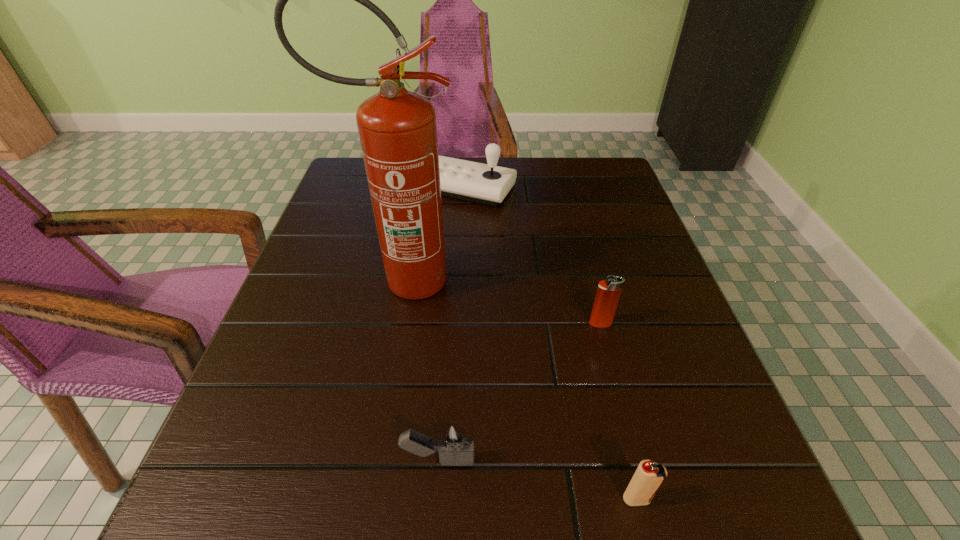
Find the location of a particular element. The height and width of the screenshot is (540, 960). the tallest object is located at coordinates (x=397, y=128).

In order to click on the fourth nearest object in this screenshot , I will do `click(397, 128)`.

The width and height of the screenshot is (960, 540). Identify the location of the farthest object. (488, 184).

At what (x,y) coordinates should I click in order to perform the action: click on the farthest igniter. Please return your answer as a coordinate pair (x, y). Looking at the image, I should click on (608, 293).

Image resolution: width=960 pixels, height=540 pixels. Find the location of `the second nearest igniter`. the second nearest igniter is located at coordinates (454, 442).

You are a GUI agent. You are given a task and a screenshot of the screen. Output one action in this format:
    pyautogui.click(x=<x>, y=<y>)
    Task: Click on the leftmost igniter
    The height and width of the screenshot is (540, 960).
    Given the screenshot: What is the action you would take?
    pyautogui.click(x=454, y=442)

The height and width of the screenshot is (540, 960). Find the location of `the nearest object`. the nearest object is located at coordinates click(649, 476).

At what (x,y) coordinates should I click in order to perform the action: click on vacant space located from the nozzle of the fire extinguisher. Please return your answer as a coordinate pair (x, y). This screenshot has width=960, height=540. Looking at the image, I should click on (488, 281).

In order to click on vacant region located 0.200m on the left of the farthest object in this screenshot , I will do `click(335, 188)`.

The width and height of the screenshot is (960, 540). I want to click on vacant space located 0.140m on the left of the third farthest object, so click(x=515, y=323).